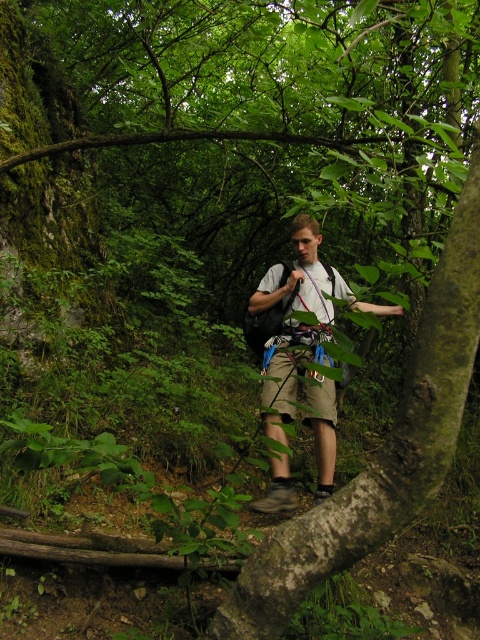
Who is shorter, green rough bark tree trunk at center or light gray fabric backpack at center?

Standing shorter between the two is green rough bark tree trunk at center.

Is point (444, 472) in front of point (287, 365)?

Yes, point (444, 472) is closer to viewer.

Identify the location of green rough bark tree trunk at center. (380, 451).